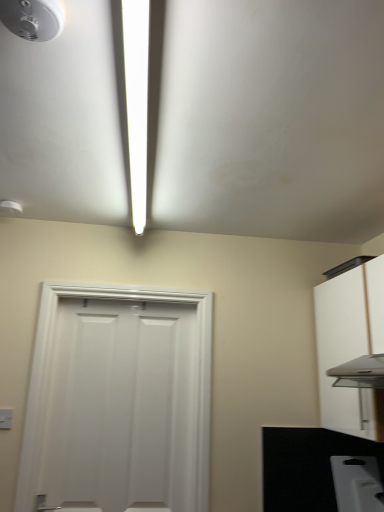
Question: Is white glossy light fixture at upper center facing towards black matte countertop at lower right?

Choices:
 (A) yes
 (B) no

Answer: (B)

Question: Considering the relative sizes of white glossy light fixture at upper center and black matte countertop at lower right in the image provided, is white glossy light fixture at upper center shorter than black matte countertop at lower right?

Choices:
 (A) no
 (B) yes

Answer: (B)

Question: Does white glossy light fixture at upper center appear on the right side of black matte countertop at lower right?

Choices:
 (A) no
 (B) yes

Answer: (A)

Question: Does white glossy light fixture at upper center have a greater height compared to black matte countertop at lower right?

Choices:
 (A) yes
 (B) no

Answer: (B)

Question: Is black matte countertop at lower right at the back of white glossy light fixture at upper center?

Choices:
 (A) yes
 (B) no

Answer: (B)

Question: Would you say white glossy light fixture at upper center is outside black matte countertop at lower right?

Choices:
 (A) no
 (B) yes

Answer: (B)

Question: Is white plastic light switch at lower left not near white plastic toaster at lower right?

Choices:
 (A) yes
 (B) no

Answer: (A)

Question: Is white plastic light switch at lower left facing away from white plastic toaster at lower right?

Choices:
 (A) no
 (B) yes

Answer: (A)

Question: From the image's perspective, is white plastic light switch at lower left above white plastic toaster at lower right?

Choices:
 (A) no
 (B) yes

Answer: (B)

Question: Does white plastic light switch at lower left turn towards white plastic toaster at lower right?

Choices:
 (A) no
 (B) yes

Answer: (A)

Question: Considering the relative sizes of white plastic light switch at lower left and white plastic toaster at lower right in the image provided, is white plastic light switch at lower left wider than white plastic toaster at lower right?

Choices:
 (A) yes
 (B) no

Answer: (B)

Question: Does white plastic light switch at lower left appear on the right side of white plastic toaster at lower right?

Choices:
 (A) yes
 (B) no

Answer: (B)

Question: From the image's perspective, is white matte cabinet at right over white matte door at center?

Choices:
 (A) no
 (B) yes

Answer: (B)